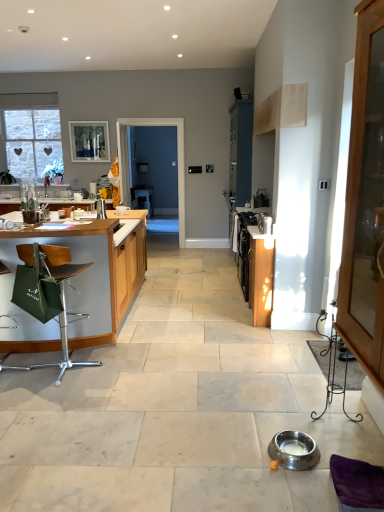
Find the location of a particular element. This screenshot has width=384, height=512. free space to the left of stainless steel bowl at lower center, marked as the second appliance in a back-to-front arrangement is located at coordinates (244, 452).